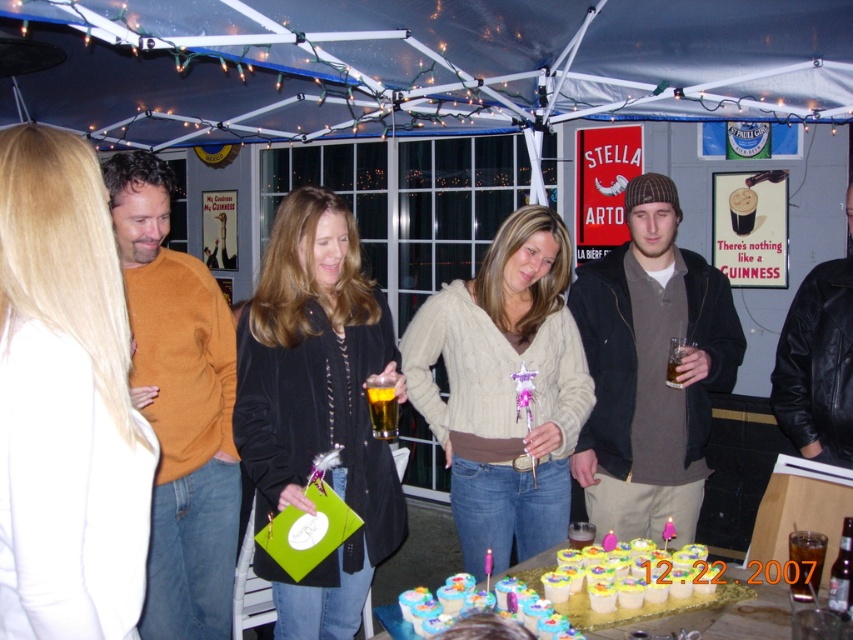
You are at the party and want to take a photo of the mustard yellow sweater at left and the black leather jacket at center. Which one will appear larger in the photo?

The mustard yellow sweater at left will appear larger in the photo because it is closer to the camera than the black leather jacket at center.

You are a guest at the party and want to find the matte black jacket at center. Where would you look relative to the dark brown knit hat at center?

The matte black jacket at center is located below the dark brown knit hat at center, so you should look downward from the dark brown knit hat at center to find it.

You are organizing a photo shoot for a fashion magazine and need to place a matte black jacket at center and a dark brown knit hat at center in a way that maintains their visibility. Given their sizes, which item should you position closer to the camera to ensure both are clearly visible in the photo?

The matte black jacket at center is smaller than the dark brown knit hat at center, so to ensure both are clearly visible, position the matte black jacket at center closer to the camera since its smaller size requires it to be nearer for better visibility.